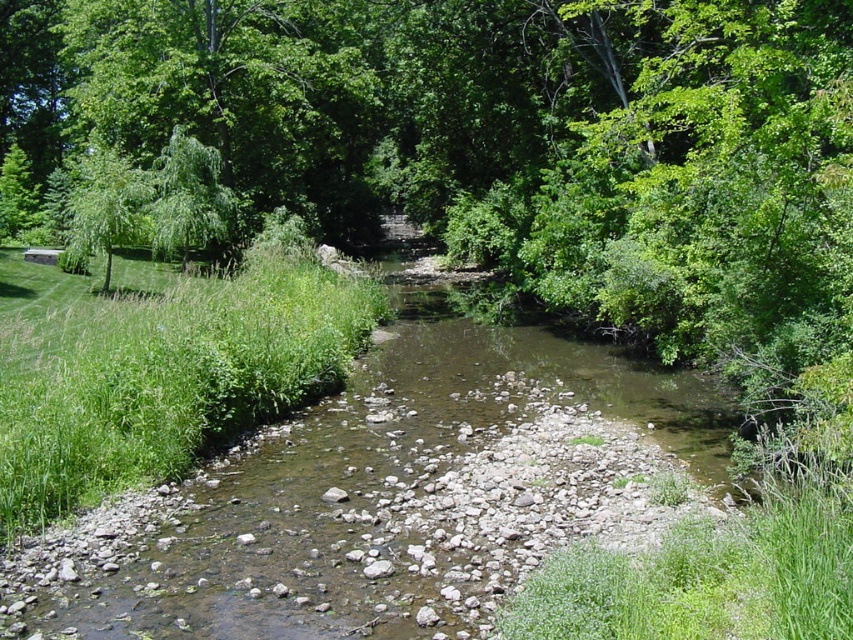
Question: Where is green grass at left located in relation to green leafy tree at upper left in the image?

Choices:
 (A) below
 (B) above

Answer: (A)

Question: Is green grass at left below green leafy tree at left?

Choices:
 (A) yes
 (B) no

Answer: (A)

Question: Which of these objects is positioned farthest from the green grass at left?

Choices:
 (A) green leafy tree at left
 (B) green leafy tree at upper left

Answer: (A)

Question: Is green grass at left to the left of green leafy tree at upper left from the viewer's perspective?

Choices:
 (A) yes
 (B) no

Answer: (B)

Question: Which point appears farthest from the camera in this image?

Choices:
 (A) (184, 211)
 (B) (108, 230)
 (C) (3, 419)

Answer: (A)

Question: Which point is closer to the camera?

Choices:
 (A) green leafy tree at left
 (B) green leafy tree at upper left
 (C) green grass at left

Answer: (C)